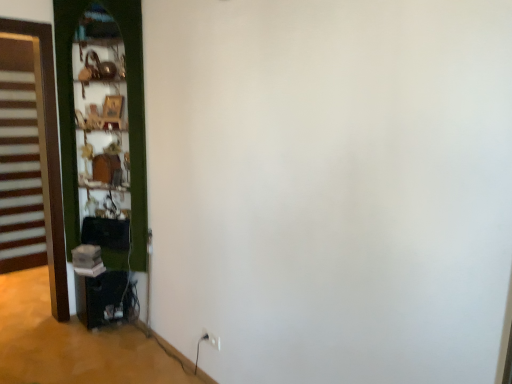
Question: Is brown wooden door at left, positioned as the second door in right-to-left order, looking in the opposite direction of green wooden door at left, acting as the 1th door starting from the right?

Choices:
 (A) yes
 (B) no

Answer: (B)

Question: From the image's perspective, would you say brown wooden door at left, positioned as the second door in right-to-left order, is positioned over green wooden door at left, arranged as the 2th door when viewed from the left?

Choices:
 (A) no
 (B) yes

Answer: (A)

Question: Is brown wooden door at left, positioned as the second door in right-to-left order, to the left of green wooden door at left, acting as the 1th door starting from the right, from the viewer's perspective?

Choices:
 (A) no
 (B) yes

Answer: (B)

Question: From a real-world perspective, is brown wooden door at left, the 1th door viewed from the left, under green wooden door at left, acting as the 1th door starting from the right?

Choices:
 (A) no
 (B) yes

Answer: (B)

Question: Is brown wooden door at left, positioned as the second door in right-to-left order, far away from green wooden door at left, acting as the 1th door starting from the right?

Choices:
 (A) no
 (B) yes

Answer: (B)

Question: Is brown wooden door at left, the 1th door viewed from the left, thinner than green wooden door at left, acting as the 1th door starting from the right?

Choices:
 (A) no
 (B) yes

Answer: (B)

Question: Is brown wooden door at left, positioned as the second door in right-to-left order, oriented towards white plastic electric outlet at lower center?

Choices:
 (A) yes
 (B) no

Answer: (B)

Question: Does brown wooden door at left, the 1th door viewed from the left, have a lesser height compared to white plastic electric outlet at lower center?

Choices:
 (A) yes
 (B) no

Answer: (B)

Question: Considering the relative sizes of brown wooden door at left, positioned as the second door in right-to-left order, and white plastic electric outlet at lower center in the image provided, is brown wooden door at left, positioned as the second door in right-to-left order, bigger than white plastic electric outlet at lower center?

Choices:
 (A) no
 (B) yes

Answer: (B)

Question: Is brown wooden door at left, the 1th door viewed from the left, at the right side of white plastic electric outlet at lower center?

Choices:
 (A) yes
 (B) no

Answer: (B)

Question: Considering the relative sizes of brown wooden door at left, positioned as the second door in right-to-left order, and white plastic electric outlet at lower center in the image provided, is brown wooden door at left, positioned as the second door in right-to-left order, taller than white plastic electric outlet at lower center?

Choices:
 (A) yes
 (B) no

Answer: (A)

Question: Does brown wooden door at left, positioned as the second door in right-to-left order, have a smaller size compared to white plastic electric outlet at lower center?

Choices:
 (A) yes
 (B) no

Answer: (B)

Question: Is white plastic electric outlet at lower center not close to green wooden door at left, acting as the 1th door starting from the right?

Choices:
 (A) no
 (B) yes

Answer: (B)